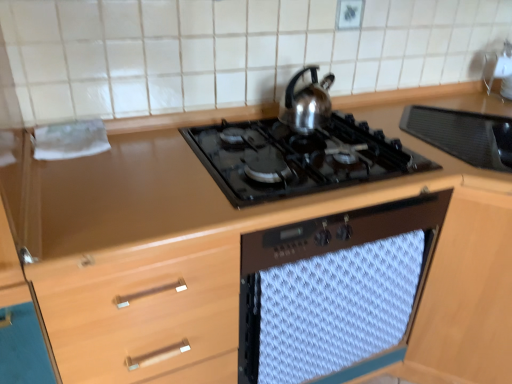
Question: Is satin silver kettle at upper center spatially inside white textured towel at center, or outside of it?

Choices:
 (A) outside
 (B) inside

Answer: (A)

Question: Is satin silver kettle at upper center taller or shorter than white textured towel at center?

Choices:
 (A) short
 (B) tall

Answer: (A)

Question: Based on their relative distances, which object is farther from the black glass gas stove at center?

Choices:
 (A) satin silver kettle at upper center
 (B) white textured towel at center

Answer: (B)

Question: Considering the real-world distances, which object is farthest from the black glass gas stove at center?

Choices:
 (A) satin silver kettle at upper center
 (B) white textured towel at center

Answer: (B)